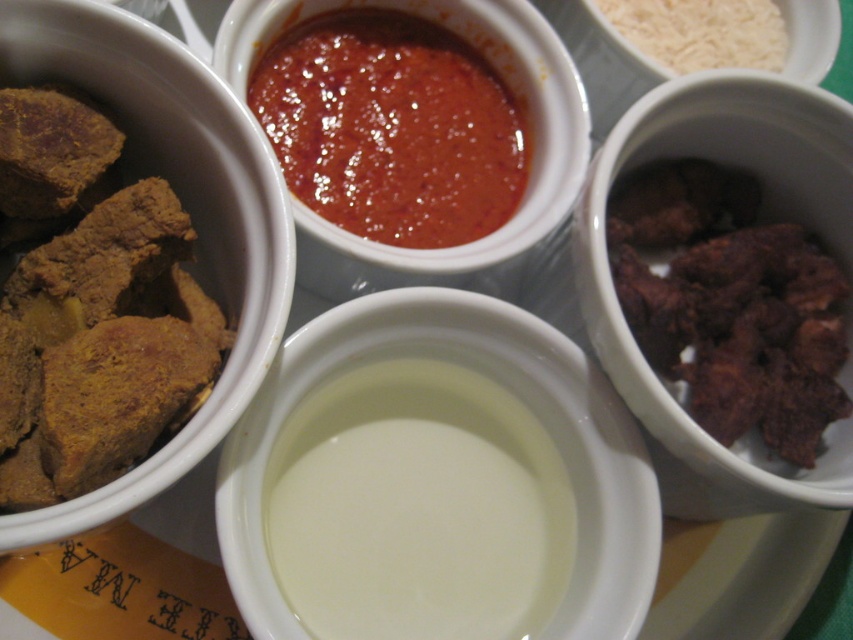
Is brown crumbly bread at left above dark brown crispy meat at right?

Correct, brown crumbly bread at left is located above dark brown crispy meat at right.

Where is `brown crumbly bread at left`? This screenshot has width=853, height=640. brown crumbly bread at left is located at coordinates [x=90, y=307].

Is point (201, 324) positioned in front of point (798, 332)?

Yes, point (201, 324) is in front of point (798, 332).

You are a GUI agent. You are given a task and a screenshot of the screen. Output one action in this format:
    pyautogui.click(x=<x>, y=<y>)
    Task: Click on the brown crumbly bread at left
    The width and height of the screenshot is (853, 640).
    Given the screenshot: What is the action you would take?
    pyautogui.click(x=90, y=307)

Measure the distance between point (x=444, y=216) and camera.

Point (x=444, y=216) and camera are 37.36 inches apart from each other.

Who is shorter, shiny red sauce at center top or dark brown crispy meat at right?

Standing shorter between the two is shiny red sauce at center top.

Who is more distant from viewer, (456, 160) or (802, 321)?

The point (456, 160) is behind.

Identify the location of shiny red sauce at center top. The height and width of the screenshot is (640, 853). (392, 128).

Between shiny red sauce at center top and white rice at upper right, which one appears on the right side from the viewer's perspective?

white rice at upper right

Is point (436, 35) behind point (726, 61)?

No, (436, 35) is in front of (726, 61).

Identify the location of shiny red sauce at center top. (392, 128).